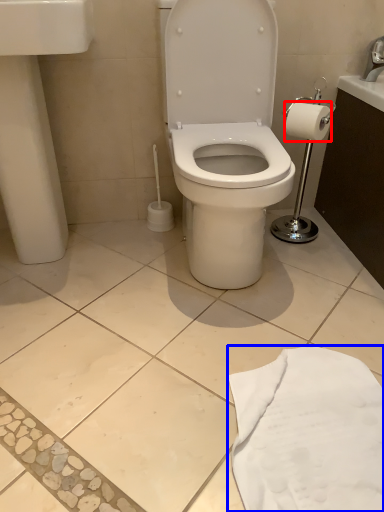
Question: Which object appears closest to the camera in this image, toilet paper (highlighted by a red box) or cloth (highlighted by a blue box)?

Choices:
 (A) toilet paper
 (B) cloth

Answer: (B)